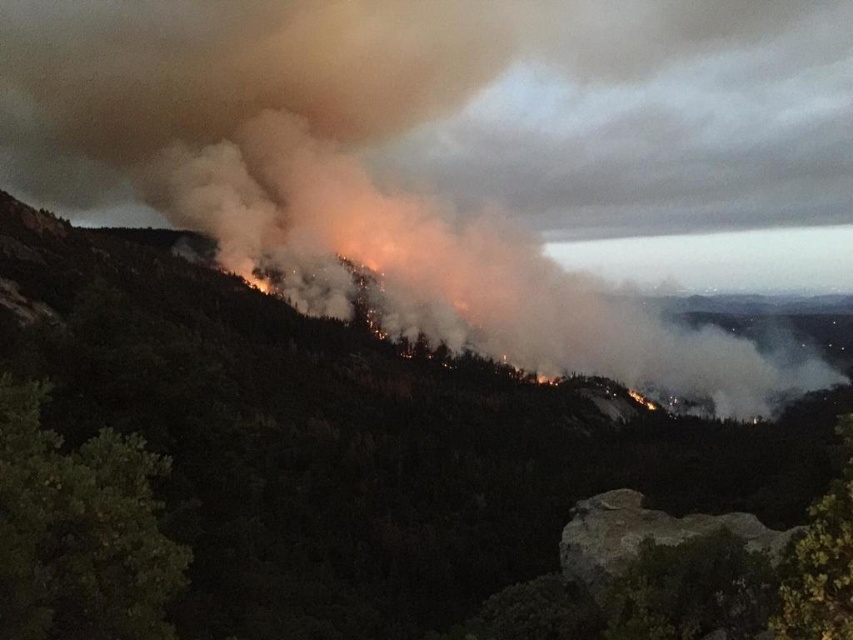
Does smoky green forest at center have a lesser width compared to smoke/dense at upper center?

Correct, smoky green forest at center's width is less than smoke/dense at upper center's.

Which is more to the left, smoky green forest at center or smoke/dense at upper center?

From the viewer's perspective, smoky green forest at center appears more on the left side.

Image resolution: width=853 pixels, height=640 pixels. I want to click on smoky green forest at center, so click(351, 442).